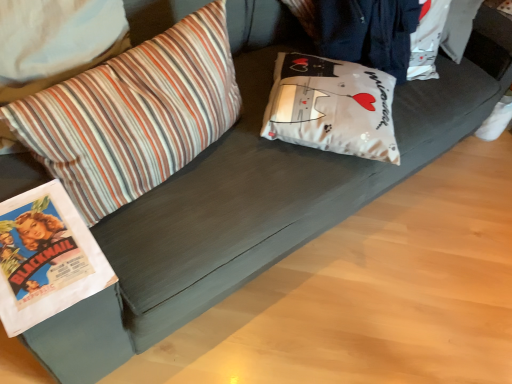
Question: Based on their sizes in the image, would you say striped fabric pillow at left, positioned as the 2th pillow in right-to-left order, is bigger or smaller than white matte pillow at center, acting as the 2th pillow starting from the left?

Choices:
 (A) small
 (B) big

Answer: (B)

Question: Considering the positions of point (219, 24) and point (381, 134), is point (219, 24) closer or farther from the camera than point (381, 134)?

Choices:
 (A) closer
 (B) farther

Answer: (A)

Question: Would you say striped fabric pillow at left, positioned as the 2th pillow in right-to-left order, is inside or outside white matte pillow at center, acting as the 2th pillow starting from the left?

Choices:
 (A) outside
 (B) inside

Answer: (A)

Question: Does point (348, 115) appear closer or farther from the camera than point (174, 54)?

Choices:
 (A) farther
 (B) closer

Answer: (A)

Question: Is white matte pillow at center, acting as the 2th pillow starting from the left, in front of or behind striped fabric pillow at left, which is the 1th pillow in left-to-right order, in the image?

Choices:
 (A) behind
 (B) front

Answer: (A)

Question: Is white matte pillow at center, arranged as the first pillow when viewed from the right, inside or outside of striped fabric pillow at left, which is the 1th pillow in left-to-right order?

Choices:
 (A) inside
 (B) outside

Answer: (B)

Question: Considering the positions of white matte pillow at center, arranged as the first pillow when viewed from the right, and striped fabric pillow at left, which is the 1th pillow in left-to-right order, in the image, is white matte pillow at center, arranged as the first pillow when viewed from the right, taller or shorter than striped fabric pillow at left, which is the 1th pillow in left-to-right order,?

Choices:
 (A) short
 (B) tall

Answer: (A)